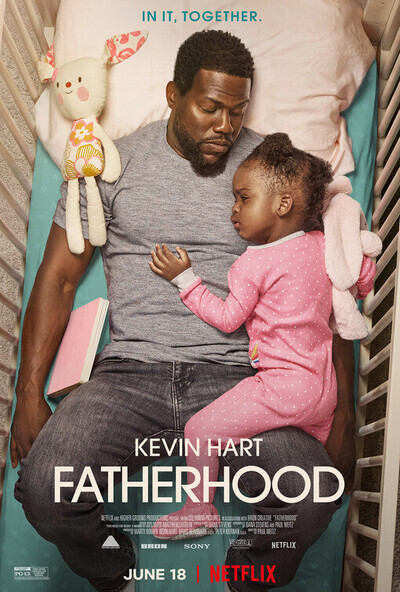
Where is `stuffed animal`? Image resolution: width=400 pixels, height=592 pixels. stuffed animal is located at coordinates (75, 150).